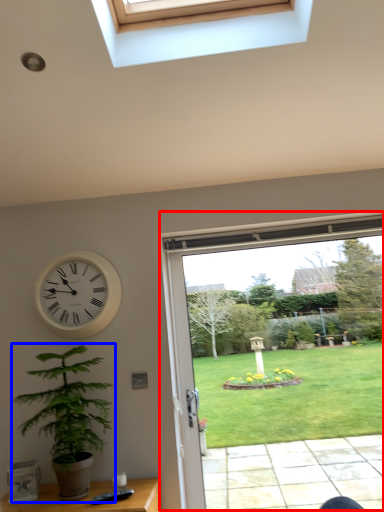
Question: Which point is closer to the camera, window (highlighted by a red box) or houseplant (highlighted by a blue box)?

Choices:
 (A) window
 (B) houseplant

Answer: (B)